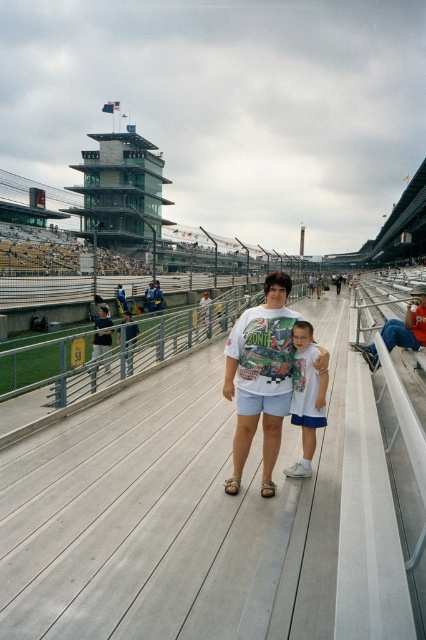
Looking at this image, you are a photographer standing on the wooden planks at center and want to take a photo of the white cotton shirt at center. Do you think you can reach it with your 1.0 meter long selfie stick?

The wooden planks at center and white cotton shirt at center are 1.17 meters apart. Since the selfie stick is only 1.0 meters long, you cannot reach the white cotton shirt at center from the wooden planks at center.